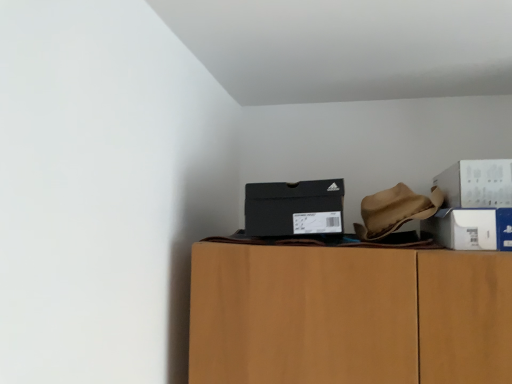
Question: Should I look upward or downward to see black matte shoebox at upper center, the 3th box from the right?

Choices:
 (A) down
 (B) up

Answer: (A)

Question: Does black matte shoebox at upper center, which is counted as the 1th box, starting from the left, turn towards white cardboard box at right, which is the second box from left to right?

Choices:
 (A) yes
 (B) no

Answer: (B)

Question: From the image's perspective, is black matte shoebox at upper center, the 3th box from the right, under white cardboard box at right, which ranks as the 2th box in right-to-left order?

Choices:
 (A) yes
 (B) no

Answer: (B)

Question: Does black matte shoebox at upper center, the 3th box from the right, appear on the left side of white cardboard box at right, which is the second box from left to right?

Choices:
 (A) no
 (B) yes

Answer: (B)

Question: Is black matte shoebox at upper center, which is counted as the 1th box, starting from the left, turned away from white cardboard box at right, which ranks as the 2th box in right-to-left order?

Choices:
 (A) no
 (B) yes

Answer: (A)

Question: Is black matte shoebox at upper center, the 3th box from the right, wider than white cardboard box at right, which is the second box from left to right?

Choices:
 (A) no
 (B) yes

Answer: (A)

Question: Is black matte shoebox at upper center, which is counted as the 1th box, starting from the left, at the right side of white cardboard box at right, which is the second box from left to right?

Choices:
 (A) yes
 (B) no

Answer: (B)

Question: Is white cardboard box at right, which ranks as the 2th box in right-to-left order, located outside white cardboard box at upper right, the third box in the left-to-right sequence?

Choices:
 (A) yes
 (B) no

Answer: (A)

Question: From the image's perspective, is white cardboard box at right, which is the second box from left to right, below white cardboard box at upper right, the third box in the left-to-right sequence?

Choices:
 (A) yes
 (B) no

Answer: (A)

Question: Is white cardboard box at right, which ranks as the 2th box in right-to-left order, taller than white cardboard box at upper right, the third box in the left-to-right sequence?

Choices:
 (A) no
 (B) yes

Answer: (A)

Question: Is white cardboard box at upper right, the third box in the left-to-right sequence, at the back of white cardboard box at right, which ranks as the 2th box in right-to-left order?

Choices:
 (A) yes
 (B) no

Answer: (B)

Question: Does white cardboard box at right, which is the second box from left to right, have a lesser width compared to white cardboard box at upper right, the third box in the left-to-right sequence?

Choices:
 (A) no
 (B) yes

Answer: (B)

Question: Does white cardboard box at right, which is the second box from left to right, appear on the left side of white cardboard box at upper right, the third box in the left-to-right sequence?

Choices:
 (A) yes
 (B) no

Answer: (A)

Question: Can you confirm if white cardboard box at right, which ranks as the 2th box in right-to-left order, is shorter than black matte shoebox at upper center, which is counted as the 1th box, starting from the left?

Choices:
 (A) yes
 (B) no

Answer: (A)